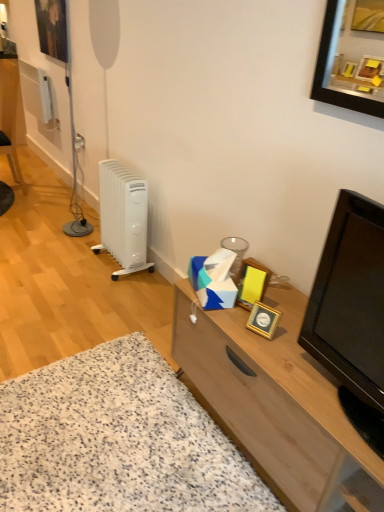
In order to click on free space behind gold metallic picture frame at center-right, the second picture frame from the back in this screenshot , I will do `click(274, 280)`.